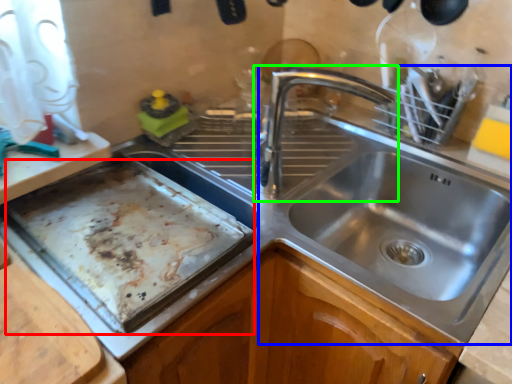
Question: Which object is positioned farthest from baking sheet (highlighted by a red box)? Select from sink (highlighted by a blue box) and tap (highlighted by a green box).

Choices:
 (A) sink
 (B) tap

Answer: (A)